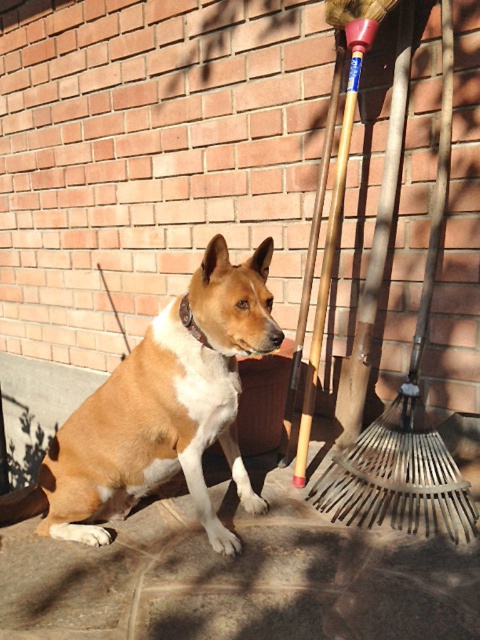
Question: Which point is closer to the camera taking this photo?

Choices:
 (A) (118, 472)
 (B) (127, 586)

Answer: (B)

Question: Is brown stone pavement at lower center closer to the viewer compared to wooden shovel at right?

Choices:
 (A) yes
 (B) no

Answer: (A)

Question: Is brown stone pavement at lower center below wooden shovel at right?

Choices:
 (A) no
 (B) yes

Answer: (B)

Question: Which object is farther from the camera taking this photo?

Choices:
 (A) brown fur dog at center
 (B) wooden shovel at right

Answer: (B)

Question: Among these points, which one is farthest from the camera?

Choices:
 (A) (475, 470)
 (B) (450, 128)
 (C) (76, 472)

Answer: (A)

Question: Is brown fur dog at center below wooden shovel at right?

Choices:
 (A) no
 (B) yes

Answer: (B)